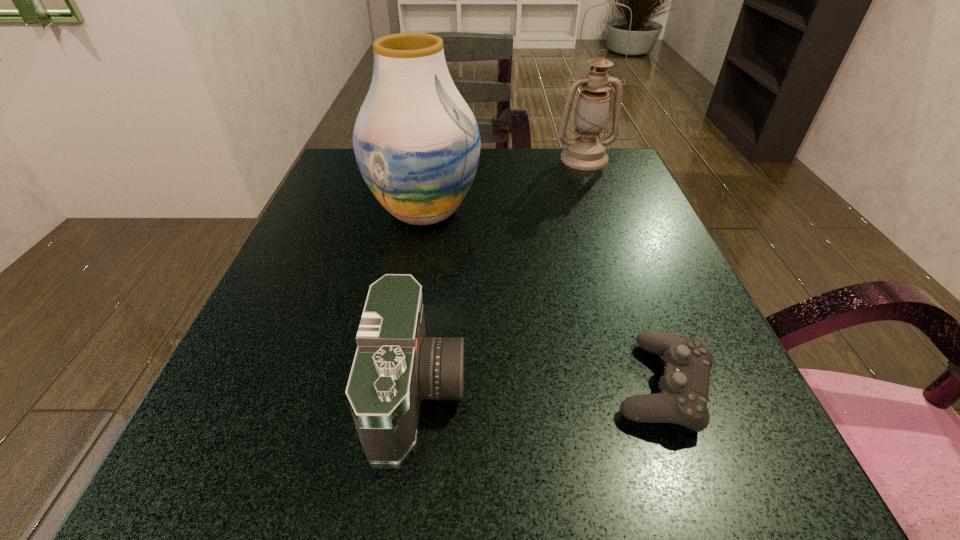
Identify the location of object that is at the near edge. (395, 366).

Image resolution: width=960 pixels, height=540 pixels. What are the coordinates of `object situated at the left edge` in the screenshot? It's located at (417, 144).

What are the coordinates of `oil lamp located at the right edge` in the screenshot? It's located at (585, 152).

The width and height of the screenshot is (960, 540). What are the coordinates of `control that is at the right edge` in the screenshot? It's located at (684, 386).

I want to click on object at the far left corner, so click(417, 144).

Locate an element on the screen. object present at the far right corner is located at coordinates (585, 152).

At what (x,y) coordinates should I click in order to perform the action: click on vacant space at the far edge. Please return your answer as a coordinate pair (x, y). This screenshot has height=540, width=960. Looking at the image, I should click on (481, 165).

Locate an element on the screen. The height and width of the screenshot is (540, 960). free space at the near edge of the desktop is located at coordinates (519, 509).

Where is `blank space at the left edge`? This screenshot has height=540, width=960. blank space at the left edge is located at coordinates (341, 294).

This screenshot has height=540, width=960. Identify the location of free region at the right edge of the desktop. (632, 300).